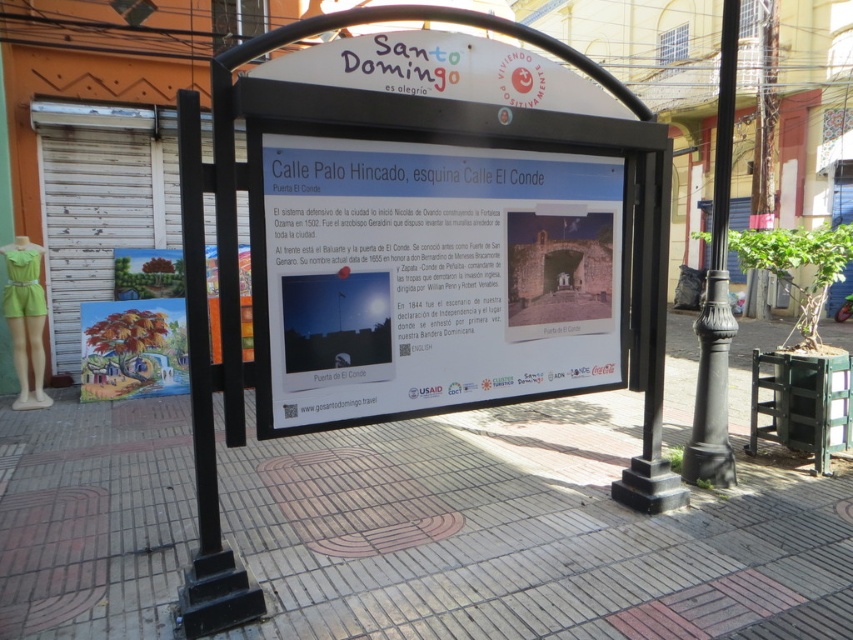
Question: Which of the following is the farthest from the observer?

Choices:
 (A) smooth concrete sidewalk at center
 (B) white paper sign at center

Answer: (A)

Question: Does smooth concrete sidewalk at center have a lesser width compared to black metal pole at right?

Choices:
 (A) no
 (B) yes

Answer: (B)

Question: Is smooth concrete sidewalk at center in front of black metal sign at center?

Choices:
 (A) no
 (B) yes

Answer: (A)

Question: In this image, where is black metal sign at center located relative to black metal pole at right?

Choices:
 (A) above
 (B) below

Answer: (B)

Question: Which object is positioned farthest from the black metal sign at center?

Choices:
 (A) black metal pole at right
 (B) white paper sign at center
 (C) smooth concrete sidewalk at center

Answer: (A)

Question: Which point is closer to the camera?

Choices:
 (A) white paper sign at center
 (B) smooth concrete sidewalk at center
 (C) black metal pole at right

Answer: (A)